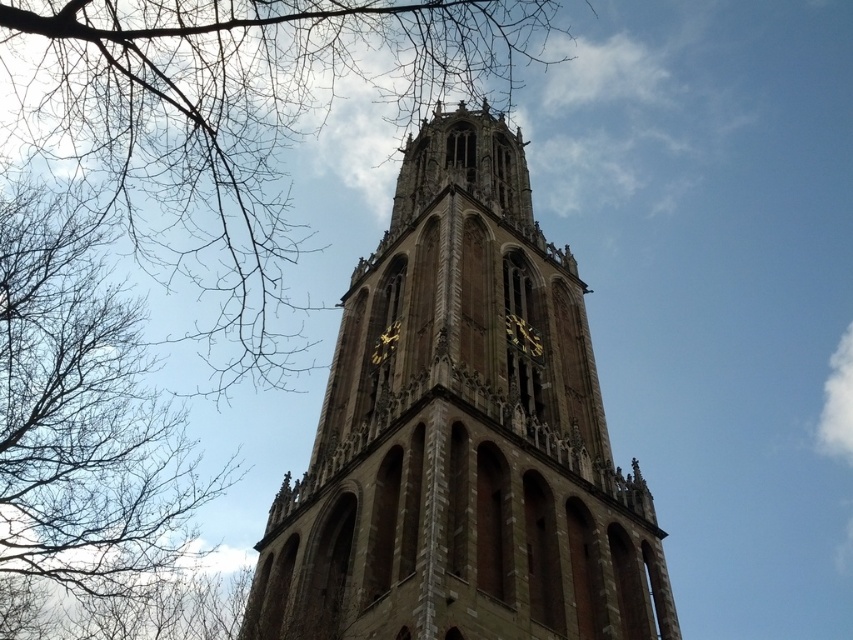
Question: Among these objects, which one is nearest to the camera?

Choices:
 (A) brown stone tower at center
 (B) bare branches at upper left

Answer: (A)

Question: Is brown stone tower at center above bare branches at upper left?

Choices:
 (A) no
 (B) yes

Answer: (A)

Question: Which of the following is the closest to the observer?

Choices:
 (A) brown stone tower at center
 (B) brown leafless branches at left
 (C) bare branches at upper left

Answer: (A)

Question: Is brown stone tower at center to the right of bare branches at upper left from the viewer's perspective?

Choices:
 (A) no
 (B) yes

Answer: (B)

Question: Which is nearer to the brown stone tower at center?

Choices:
 (A) bare branches at upper left
 (B) brown leafless branches at left

Answer: (A)

Question: Is brown stone tower at center positioned at the back of brown leafless branches at left?

Choices:
 (A) no
 (B) yes

Answer: (A)